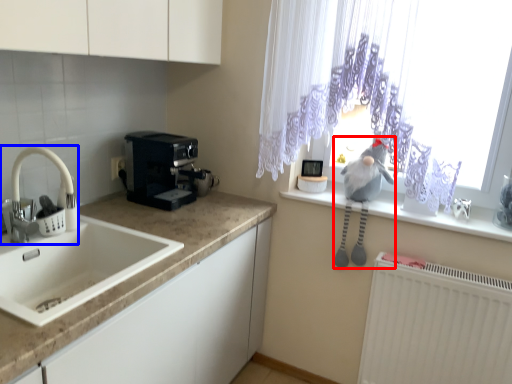
Question: Which object is closer to the camera taking this photo, animal (highlighted by a red box) or tap (highlighted by a blue box)?

Choices:
 (A) animal
 (B) tap

Answer: (B)